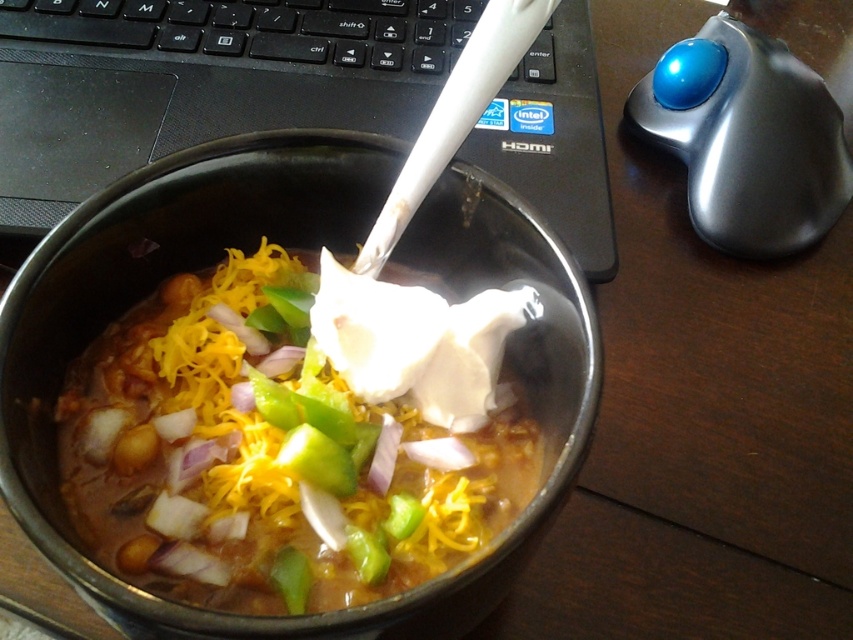
Question: Estimate the real-world distances between objects in this image. Which object is farther from the smooth white cream at center?

Choices:
 (A) metallic trackball at upper right
 (B) black plastic keyboard at upper center

Answer: (A)

Question: Can you confirm if smooth white cream at center is bigger than black plastic keyboard at upper center?

Choices:
 (A) no
 (B) yes

Answer: (B)

Question: Which object appears closest to the camera in this image?

Choices:
 (A) black plastic keyboard at upper center
 (B) metallic trackball at upper right
 (C) black plastic laptop at upper left

Answer: (C)

Question: Does smooth white cream at center have a larger size compared to black plastic keyboard at upper center?

Choices:
 (A) no
 (B) yes

Answer: (B)

Question: From the image, what is the correct spatial relationship of smooth white cream at center in relation to black plastic keyboard at upper center?

Choices:
 (A) right
 (B) left

Answer: (A)

Question: Estimate the real-world distances between objects in this image. Which object is farther from the black plastic keyboard at upper center?

Choices:
 (A) smooth white cream at center
 (B) black plastic laptop at upper left

Answer: (A)